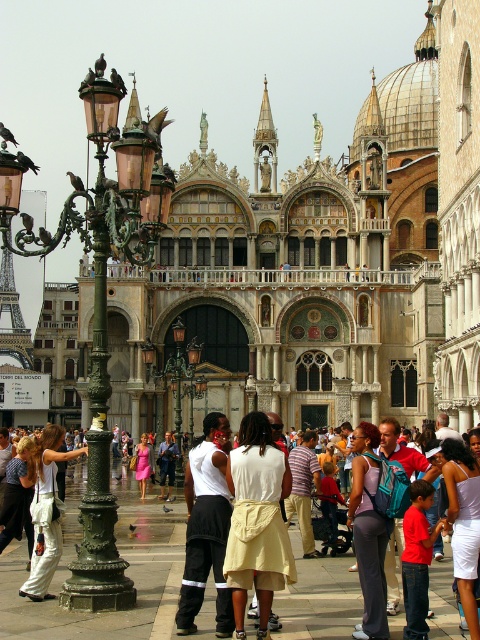
You are a photographer standing in front of the grand building and want to capture a shot of the matte purple tank top at center and the white cotton pants at lower left. Which object is covering the other in the image?

The matte purple tank top at center is positioned over the white cotton pants at lower left, so it is covering the pants in the image.

You are a photographer planning to take a photo of the cathedral in the image. You want to ensure that both the white satin dress at center and the white cotton pants at lower left are visible in the frame. Given their positions and the cathedral backdrop, which clothing item will appear closer to the camera in the final photo?

The white satin dress at center will appear closer to the camera in the final photo because it is positioned at the center, which is typically closer to the viewer compared to the lower left position of the white cotton pants at lower left.